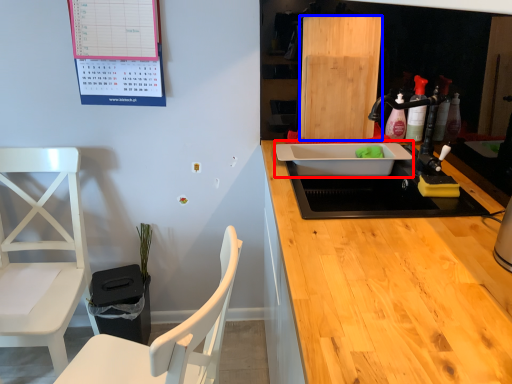
Question: Among these objects, which one is nearest to the camera, sink (highlighted by a red box) or plywood (highlighted by a blue box)?

Choices:
 (A) sink
 (B) plywood

Answer: (A)